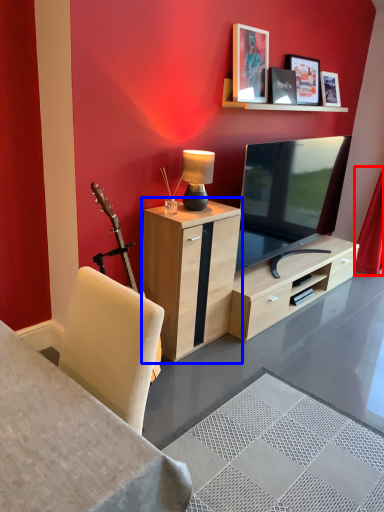
Question: Which of the following is the closest to the observer, curtain (highlighted by a red box) or cabinetry (highlighted by a blue box)?

Choices:
 (A) curtain
 (B) cabinetry

Answer: (B)